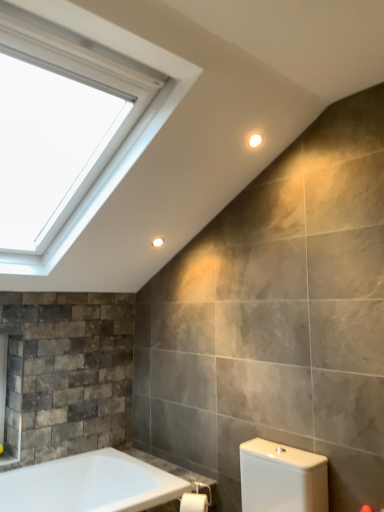
Question: Is white matte toilet paper at lower center spatially inside matte white light fixture at upper center, arranged as the 2th light fixture when viewed from the front, or outside of it?

Choices:
 (A) outside
 (B) inside

Answer: (A)

Question: Based on their positions, is white matte toilet paper at lower center located to the left or right of matte white light fixture at upper center, the first light fixture in the left-to-right sequence?

Choices:
 (A) right
 (B) left

Answer: (A)

Question: Considering the real-world distances, which object is farthest from the white matte toilet paper at lower center?

Choices:
 (A) matte white light fixture at upper center, the 1th light fixture viewed from the top
 (B) white glossy bathtub at lower left
 (C) matte white light fixture at upper center, which is the second light fixture from top to bottom

Answer: (A)

Question: Which is nearer to the white glossy bathtub at lower left?

Choices:
 (A) matte white light fixture at upper center, positioned as the 2th light fixture in right-to-left order
 (B) matte white light fixture at upper center, arranged as the first light fixture when viewed from the front
 (C) white matte toilet paper at lower center

Answer: (C)